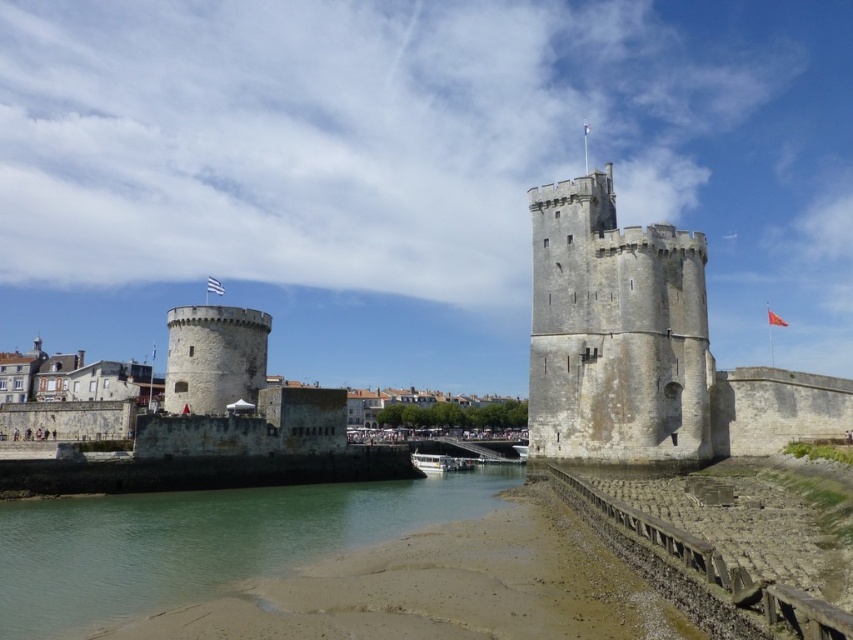
You are standing on the wooden walkway looking towards the fortress. You see the white fabric flag at center and the red fabric flag at upper center. Which flag appears larger in your view?

The white fabric flag at center appears larger because it is closer to the viewer than the red fabric flag at upper center.